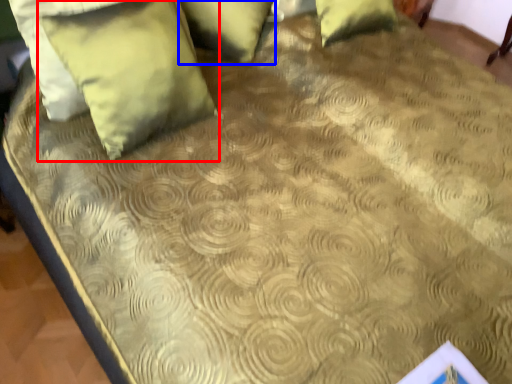
Question: Which object is further to the camera taking this photo, pillow (highlighted by a red box) or pillow (highlighted by a blue box)?

Choices:
 (A) pillow
 (B) pillow

Answer: (B)